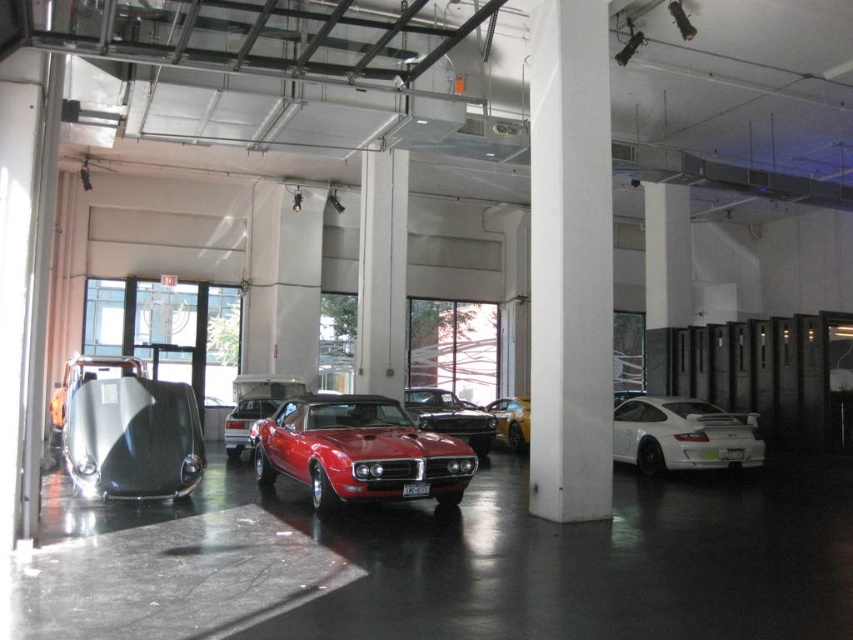
Question: Which of these objects is positioned closest to the white glossy sports car at right?

Choices:
 (A) shiny red car at center
 (B) metallic yellow car at center
 (C) shiny silver car at left
 (D) white concrete pillar at center

Answer: (B)

Question: Estimate the real-world distances between objects in this image. Which object is closer to the shiny black car at center?

Choices:
 (A) white concrete pillar at center
 (B) white glossy sports car at right

Answer: (B)

Question: Among these objects, which one is farthest from the camera?

Choices:
 (A) shiny red car at center
 (B) white concrete pillar at center
 (C) metallic yellow car at center
 (D) white glossy sports car at right

Answer: (C)

Question: Is white concrete pillar at center smaller than shiny red car at center?

Choices:
 (A) no
 (B) yes

Answer: (B)

Question: Does shiny silver car at left appear under shiny black car at center?

Choices:
 (A) yes
 (B) no

Answer: (B)

Question: Does shiny red car at center appear on the right side of shiny silver car at left?

Choices:
 (A) yes
 (B) no

Answer: (A)